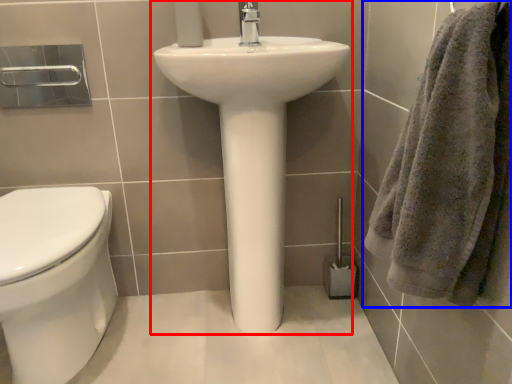
Question: Among these objects, which one is farthest to the camera, sink (highlighted by a red box) or towel (highlighted by a blue box)?

Choices:
 (A) sink
 (B) towel

Answer: (A)